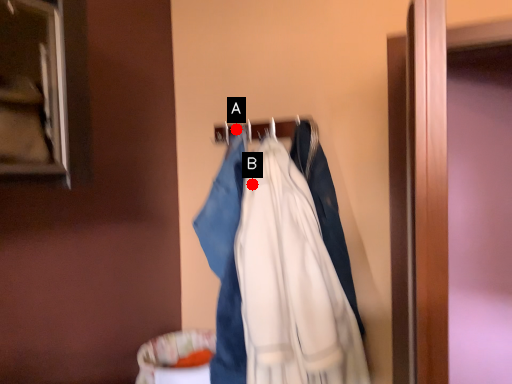
Question: Two points are circled on the image, labeled by A and B beside each circle. Which point is closer to the camera?

Choices:
 (A) A is closer
 (B) B is closer

Answer: (B)